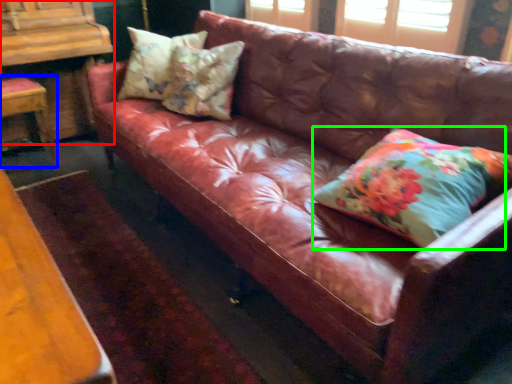
Question: Which is nearer to the dresser (highlighted by a red box)? chair (highlighted by a blue box) or pillow (highlighted by a green box).

Choices:
 (A) chair
 (B) pillow

Answer: (A)